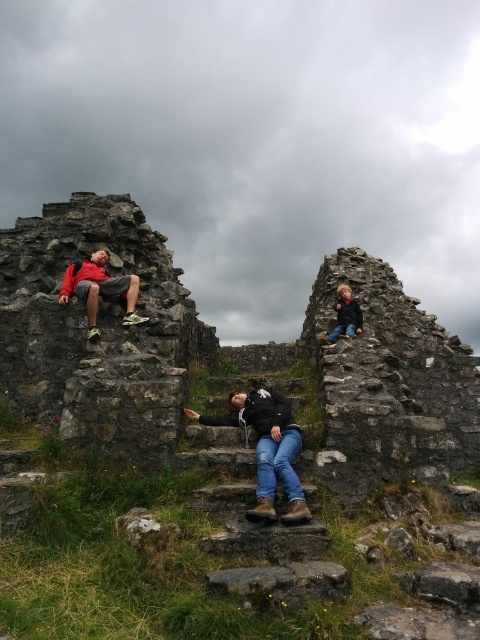
In the scene shown: Between matte black shorts at left and dark blue jacket at upper right, which one appears on the right side from the viewer's perspective?

From the viewer's perspective, dark blue jacket at upper right appears more on the right side.

Is matte black shorts at left taller than dark blue jacket at upper right?

Correct, matte black shorts at left is much taller as dark blue jacket at upper right.

Who is more distant from viewer, (98, 252) or (338, 296)?

The point (338, 296) is behind.

This screenshot has height=640, width=480. In order to click on matte black shorts at left in this screenshot , I will do `click(99, 289)`.

The height and width of the screenshot is (640, 480). I want to click on rusty stone wall at upper left, so click(x=208, y=435).

In the scene shown: Which of these two, rusty stone wall at upper left or dark blue jacket at upper right, stands shorter?

Standing shorter between the two is dark blue jacket at upper right.

Where is `rusty stone wall at upper left`? This screenshot has height=640, width=480. rusty stone wall at upper left is located at coordinates (208, 435).

Locate an element on the screen. The image size is (480, 640). rusty stone wall at upper left is located at coordinates (208, 435).

Image resolution: width=480 pixels, height=640 pixels. Find the location of `rusty stone wall at upper left`. rusty stone wall at upper left is located at coordinates [208, 435].

Which is behind, point (206, 483) or point (96, 288)?

Positioned behind is point (96, 288).

Does point (157, 440) lie behind point (123, 294)?

No, (157, 440) is in front of (123, 294).

Locate an element on the screen. rusty stone wall at upper left is located at coordinates (208, 435).